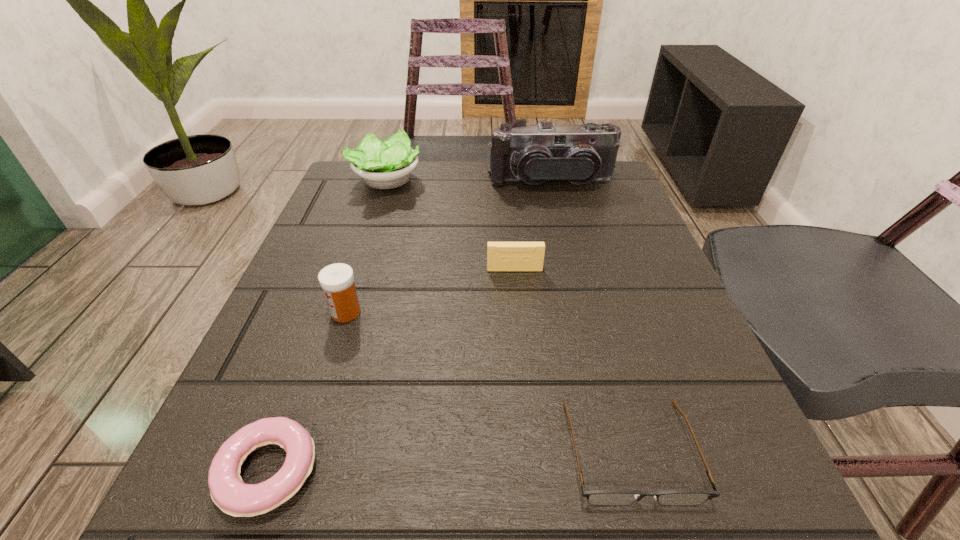
In the image, there is a desktop. At what (x,y) coordinates should I click in order to perform the action: click on vacant space at the far right corner. Please return your answer as a coordinate pair (x, y). The width and height of the screenshot is (960, 540). Looking at the image, I should click on (597, 183).

Find the location of a particular element. free space between the doughnut and the camcorder is located at coordinates (409, 326).

Locate an element on the screen. This screenshot has width=960, height=540. free space between the doughnut and the camcorder is located at coordinates (409, 326).

You are a GUI agent. You are given a task and a screenshot of the screen. Output one action in this format:
    pyautogui.click(x=<x>, y=<y>)
    Task: Click on the vacant region between the spectacles and the videotape
    The height and width of the screenshot is (540, 960).
    Given the screenshot: What is the action you would take?
    pyautogui.click(x=572, y=360)

Find the location of a particular element. Image resolution: width=960 pixels, height=540 pixels. vacant space in between the lettuce and the doughnut is located at coordinates (327, 326).

At what (x,y) coordinates should I click in order to perform the action: click on free space that is in between the tallest object and the spectacles. Please return your answer as a coordinate pair (x, y). The width and height of the screenshot is (960, 540). Looking at the image, I should click on (590, 316).

In order to click on vacant area that lies between the tallest object and the medicine in this screenshot , I will do `click(448, 247)`.

Where is `vacant space that is in between the fourth nearest object and the doughnut`? Image resolution: width=960 pixels, height=540 pixels. vacant space that is in between the fourth nearest object and the doughnut is located at coordinates (392, 370).

The width and height of the screenshot is (960, 540). What are the coordinates of `vacant region between the doughnut and the lettuce` in the screenshot? It's located at (327, 326).

Identify the location of unoccupied position between the medicine and the third shortest object. The image size is (960, 540). (430, 291).